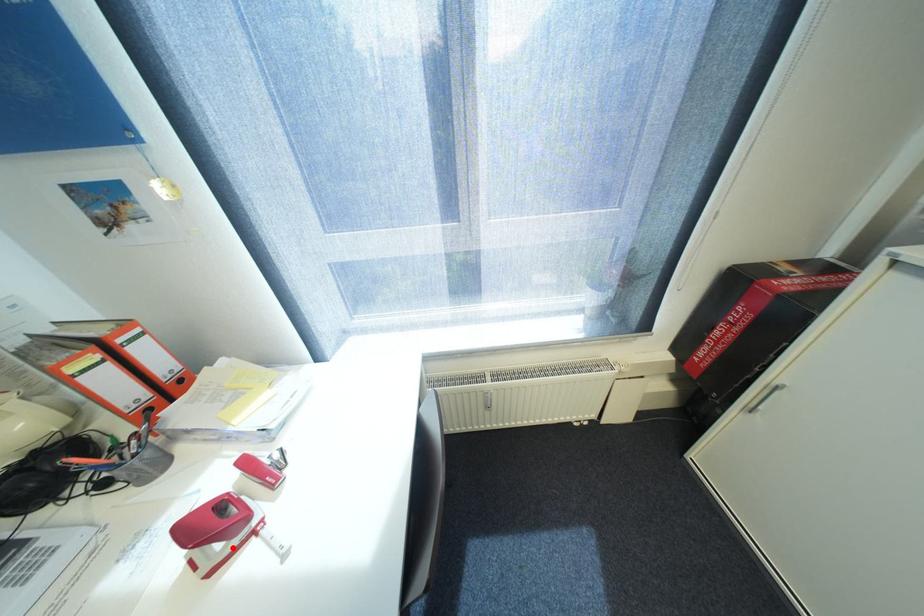
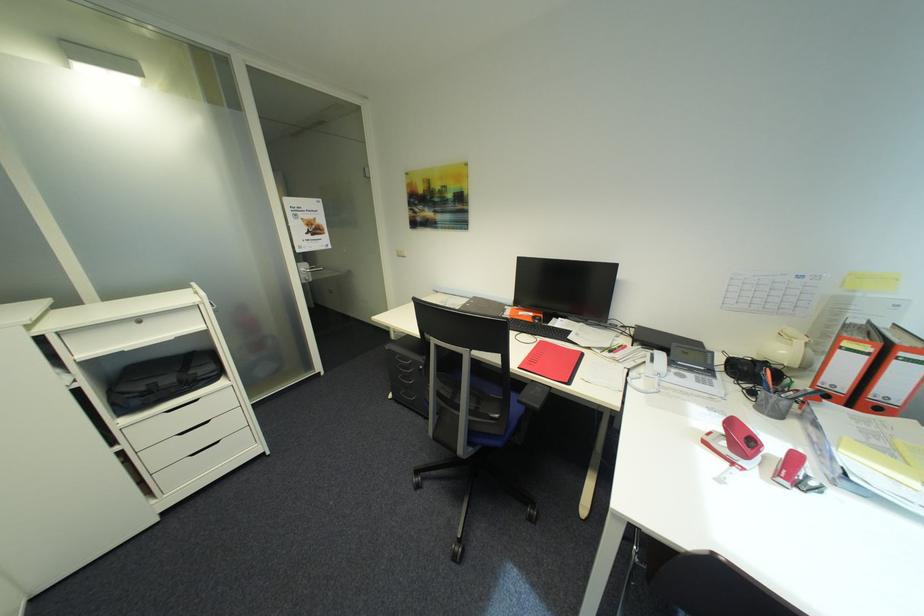
Where in the second image is the point corresponding to the highlighted location from the first image?

(730, 447)